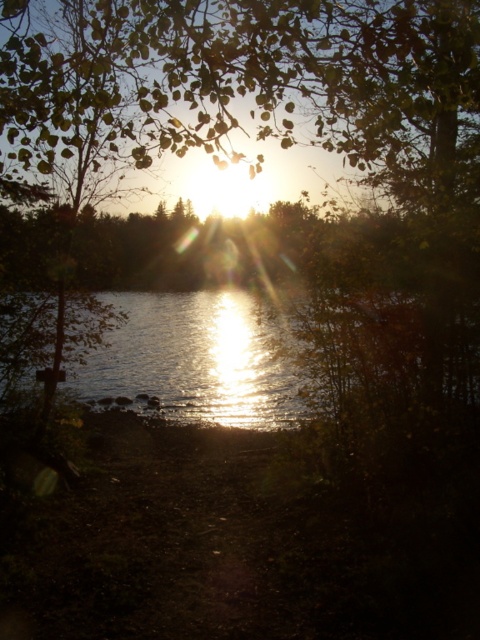
Which is above, green leafy tree at upper center or glistening reflective water at center?

green leafy tree at upper center

Measure the distance from green leafy tree at upper center to glistening reflective water at center.

green leafy tree at upper center and glistening reflective water at center are 17.35 feet apart.

The width and height of the screenshot is (480, 640). What are the coordinates of `green leafy tree at upper center` in the screenshot? It's located at (247, 83).